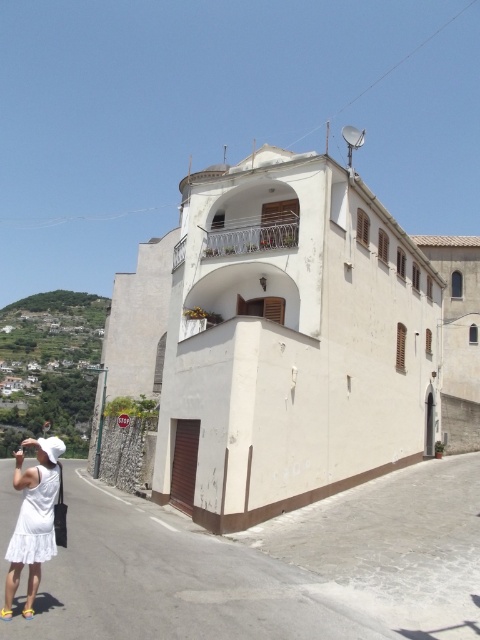
You are standing on the sidewalk in front of the building and want to take a photo. There are two points marked in the image, point 1 at coordinates point (31,576) and point 2 at coordinates point (24,515). Which point should you focus on to ensure it appears larger in your photo?

Point 1 at coordinates point (31,576) is closer to the camera, so focusing on it will make it appear larger in the photo.